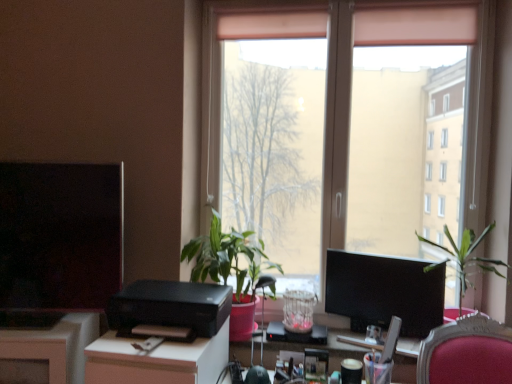
Question: Is transparent glass window at center located outside green matte plant at center, placed as the second houseplant when sorted from right to left?

Choices:
 (A) yes
 (B) no

Answer: (A)

Question: Can you confirm if transparent glass window at center is shorter than green matte plant at center, arranged as the first houseplant when viewed from the left?

Choices:
 (A) yes
 (B) no

Answer: (B)

Question: From the image's perspective, is transparent glass window at center on green matte plant at center, arranged as the first houseplant when viewed from the left?

Choices:
 (A) yes
 (B) no

Answer: (A)

Question: Considering the relative positions of transparent glass window at center and green matte plant at center, arranged as the first houseplant when viewed from the left, in the image provided, is transparent glass window at center in front of green matte plant at center, arranged as the first houseplant when viewed from the left,?

Choices:
 (A) no
 (B) yes

Answer: (A)

Question: Considering the relative sizes of transparent glass window at center and green matte plant at center, arranged as the first houseplant when viewed from the left, in the image provided, is transparent glass window at center bigger than green matte plant at center, arranged as the first houseplant when viewed from the left,?

Choices:
 (A) no
 (B) yes

Answer: (B)

Question: Does point (61, 253) appear closer or farther from the camera than point (304, 319)?

Choices:
 (A) closer
 (B) farther

Answer: (A)

Question: Considering the positions of matte black monitor at left, which appears as the 2th computer monitor when viewed from the right, and translucent glass vase at center in the image, is matte black monitor at left, which appears as the 2th computer monitor when viewed from the right, wider or thinner than translucent glass vase at center?

Choices:
 (A) wide
 (B) thin

Answer: (B)

Question: Is matte black monitor at left, which appears as the 2th computer monitor when viewed from the right, to the left or to the right of translucent glass vase at center in the image?

Choices:
 (A) left
 (B) right

Answer: (A)

Question: Is matte black monitor at left, which appears as the 2th computer monitor when viewed from the right, taller or shorter than translucent glass vase at center?

Choices:
 (A) tall
 (B) short

Answer: (A)

Question: Considering the positions of matte black monitor at center right, acting as the 1th computer monitor starting from the right, and white glossy desk at center in the image, is matte black monitor at center right, acting as the 1th computer monitor starting from the right, taller or shorter than white glossy desk at center?

Choices:
 (A) short
 (B) tall

Answer: (B)

Question: In terms of size, does matte black monitor at center right, which is the second computer monitor in left-to-right order, appear bigger or smaller than white glossy desk at center?

Choices:
 (A) big
 (B) small

Answer: (B)

Question: From the image's perspective, is matte black monitor at center right, which is the second computer monitor in left-to-right order, positioned above or below white glossy desk at center?

Choices:
 (A) below
 (B) above

Answer: (B)

Question: Would you say matte black monitor at center right, which is the second computer monitor in left-to-right order, is inside or outside white glossy desk at center?

Choices:
 (A) outside
 (B) inside

Answer: (A)

Question: Considering the positions of green leafy plant at right, the 1th houseplant in the right-to-left sequence, and green matte plant at center, placed as the second houseplant when sorted from right to left, in the image, is green leafy plant at right, the 1th houseplant in the right-to-left sequence, bigger or smaller than green matte plant at center, placed as the second houseplant when sorted from right to left,?

Choices:
 (A) small
 (B) big

Answer: (A)

Question: Is green leafy plant at right, which is counted as the 2th houseplant, starting from the left, spatially inside green matte plant at center, arranged as the first houseplant when viewed from the left, or outside of it?

Choices:
 (A) inside
 (B) outside

Answer: (B)